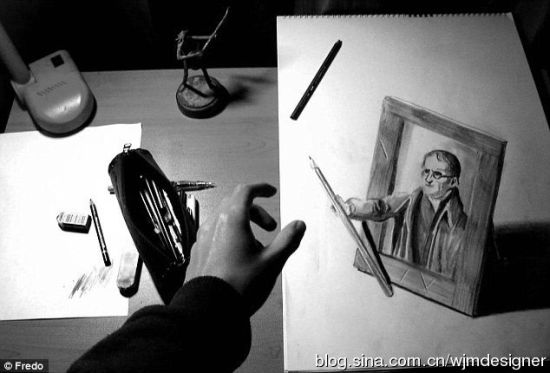
Find the location of a particular element. The image size is (550, 373). desk is located at coordinates [x=216, y=156].